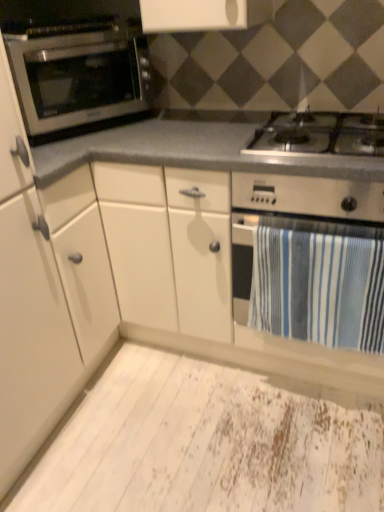
Question: Can you confirm if white distressed plywood at lower center is wider than satin silver oven at left?

Choices:
 (A) yes
 (B) no

Answer: (A)

Question: Can you confirm if white distressed plywood at lower center is thinner than satin silver oven at left?

Choices:
 (A) no
 (B) yes

Answer: (A)

Question: From the image's perspective, is white distressed plywood at lower center located above satin silver oven at left?

Choices:
 (A) no
 (B) yes

Answer: (A)

Question: From a real-world perspective, is white distressed plywood at lower center located higher than satin silver oven at left?

Choices:
 (A) yes
 (B) no

Answer: (B)

Question: Considering the relative positions of white distressed plywood at lower center and satin silver oven at left in the image provided, is white distressed plywood at lower center to the left of satin silver oven at left from the viewer's perspective?

Choices:
 (A) no
 (B) yes

Answer: (A)

Question: Would you consider white distressed plywood at lower center to be distant from satin silver oven at left?

Choices:
 (A) no
 (B) yes

Answer: (B)

Question: From a real-world perspective, does satin silver oven at left stand above blue striped towel at lower right?

Choices:
 (A) no
 (B) yes

Answer: (B)

Question: From the image's perspective, is satin silver oven at left located above blue striped towel at lower right?

Choices:
 (A) no
 (B) yes

Answer: (B)

Question: Is blue striped towel at lower right a part of satin silver oven at left?

Choices:
 (A) yes
 (B) no

Answer: (B)

Question: Considering the relative positions of satin silver oven at left and blue striped towel at lower right in the image provided, is satin silver oven at left to the left of blue striped towel at lower right from the viewer's perspective?

Choices:
 (A) yes
 (B) no

Answer: (A)

Question: Can you see satin silver oven at left touching blue striped towel at lower right?

Choices:
 (A) no
 (B) yes

Answer: (A)

Question: Does satin silver oven at left come behind blue striped towel at lower right?

Choices:
 (A) no
 (B) yes

Answer: (B)

Question: Considering the relative sizes of white matte cabinet at left and white distressed plywood at lower center in the image provided, is white matte cabinet at left shorter than white distressed plywood at lower center?

Choices:
 (A) yes
 (B) no

Answer: (B)